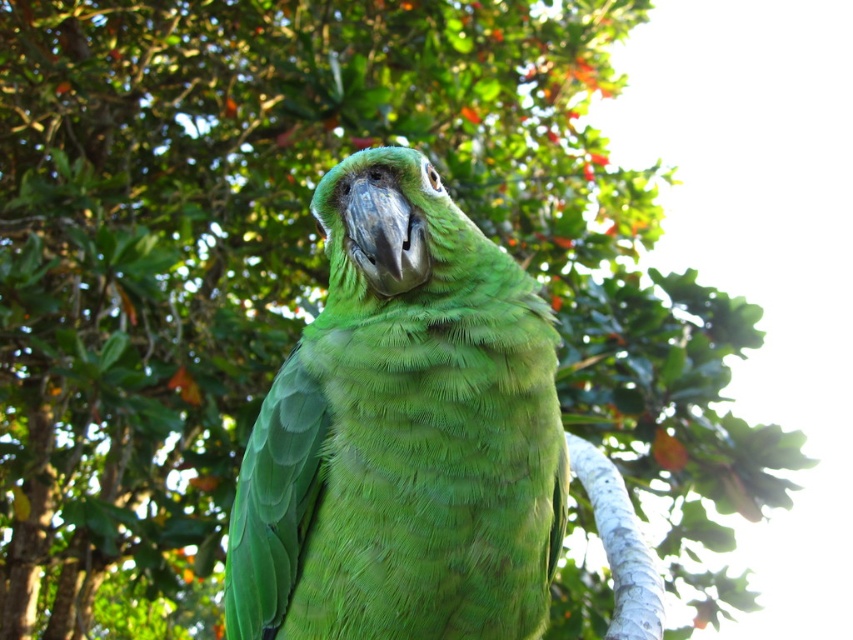
Which is more to the left, green feathered parrot at center or white smooth tree branch at center?

From the viewer's perspective, green feathered parrot at center appears more on the left side.

Who is lower down, green feathered parrot at center or white smooth tree branch at center?

white smooth tree branch at center is below.

Is point (386, 262) less distant than point (631, 632)?

Yes, it is.

The height and width of the screenshot is (640, 853). What are the coordinates of `green feathered parrot at center` in the screenshot? It's located at (403, 433).